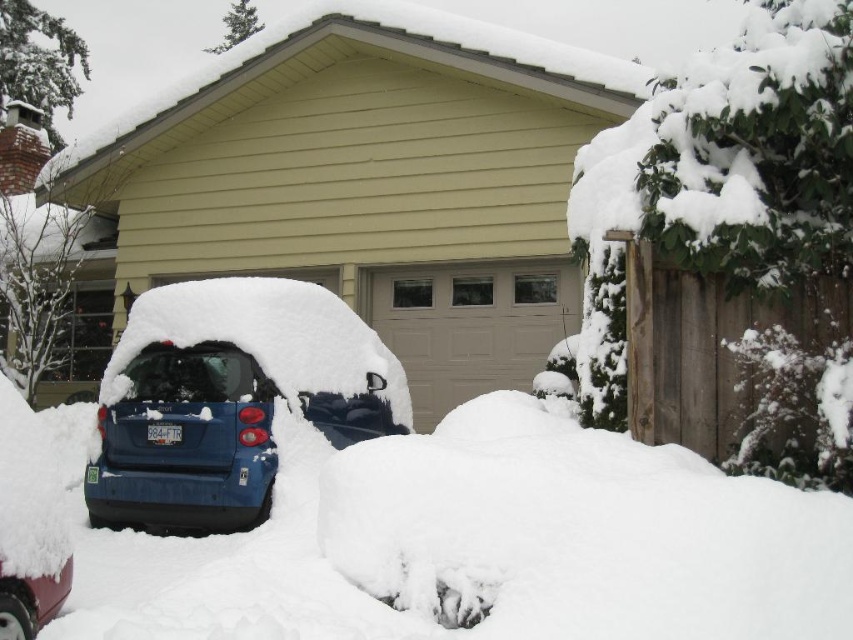
Can you confirm if matte blue car at lower left is positioned to the left of shiny red car at lower left?

Correct, you'll find matte blue car at lower left to the left of shiny red car at lower left.

Which of these two, matte blue car at lower left or shiny red car at lower left, stands shorter?

Standing shorter between the two is shiny red car at lower left.

Is point (177, 528) positioned in front of point (71, 564)?

No, it is not.

Image resolution: width=853 pixels, height=640 pixels. I want to click on matte blue car at lower left, so click(x=184, y=442).

Who is positioned more to the right, matte blue car at center or shiny red car at lower left?

matte blue car at center

Between point (259, 292) and point (32, 596), which one is positioned in front?

Positioned in front is point (32, 596).

Identify the location of matte blue car at center. This screenshot has height=640, width=853. (229, 397).

Can you confirm if matte blue car at center is wider than matte blue car at lower left?

Correct, the width of matte blue car at center exceeds that of matte blue car at lower left.

Does matte blue car at center have a greater height compared to matte blue car at lower left?

Yes.

Who is more distant from viewer, (180, 401) or (248, 404)?

The point (180, 401) is more distant.

The image size is (853, 640). In order to click on matte blue car at center in this screenshot , I will do `click(229, 397)`.